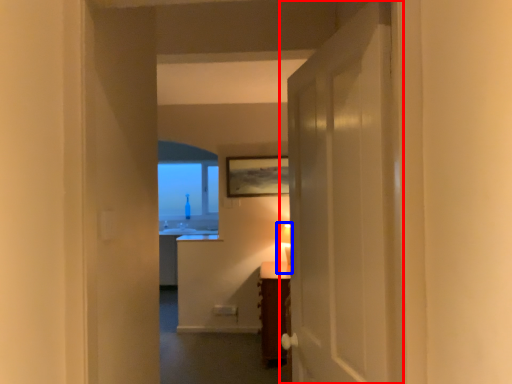
Question: Which of the following is the farthest to the observer, door (highlighted by a red box) or table lamp (highlighted by a blue box)?

Choices:
 (A) door
 (B) table lamp

Answer: (B)